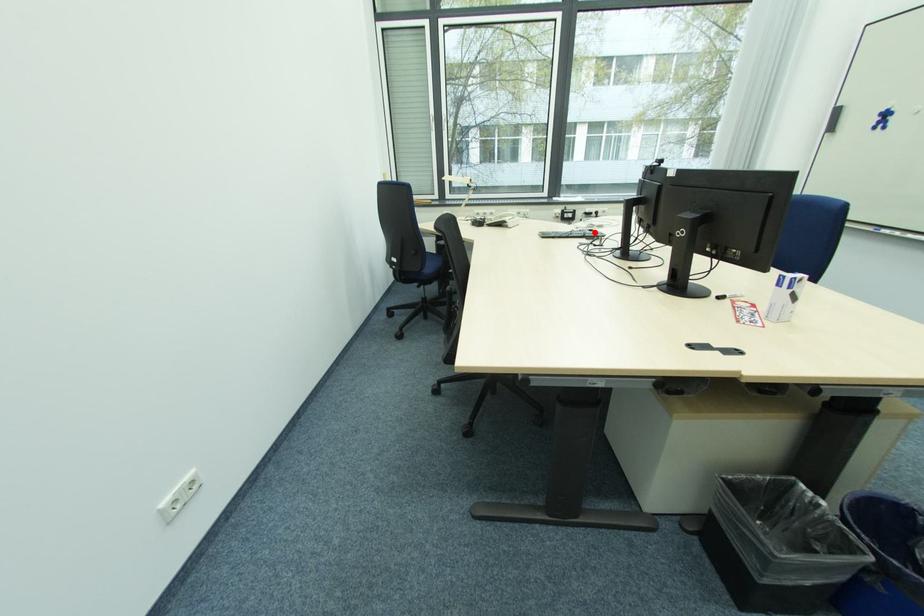
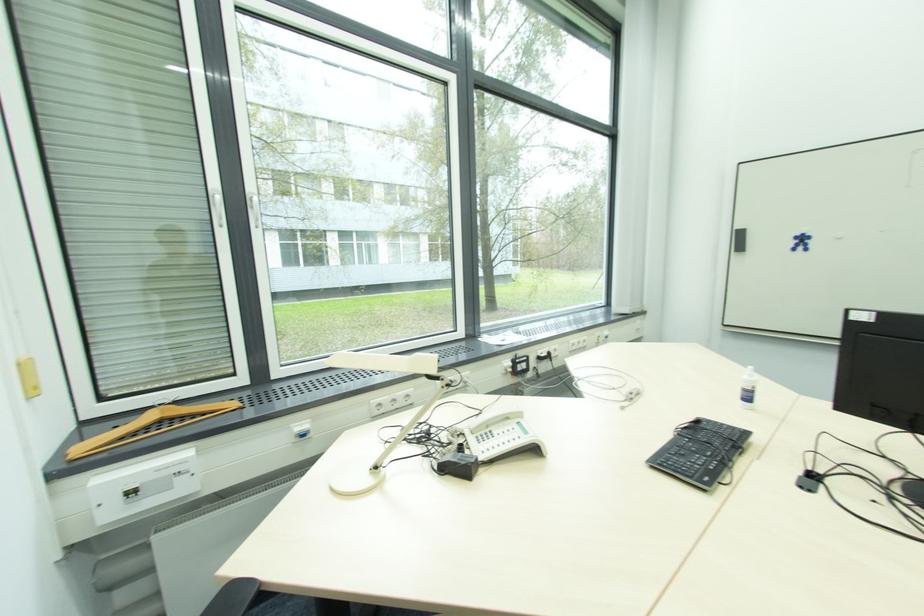
The point at the highlighted location is marked in the first image. Where is the corresponding point in the second image?

(700, 424)